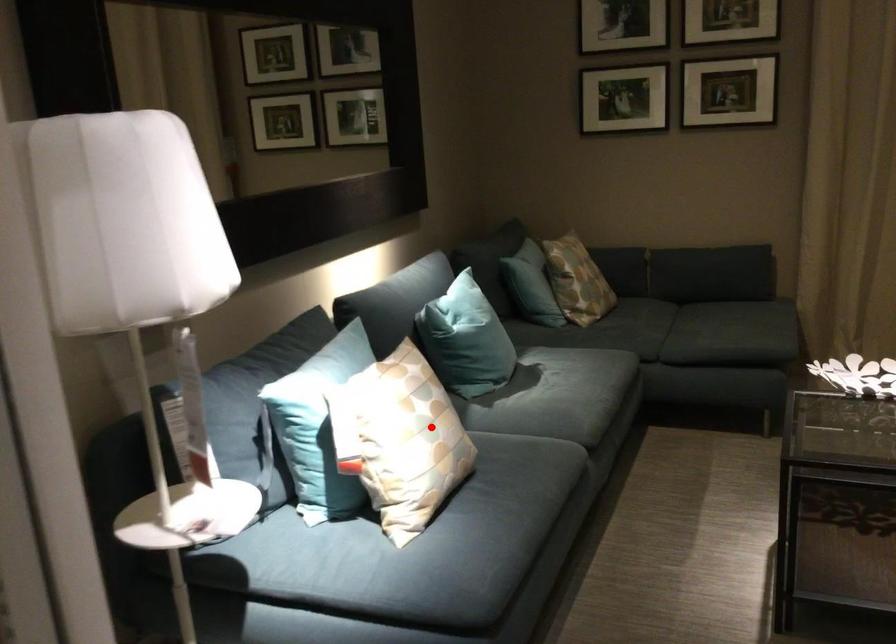
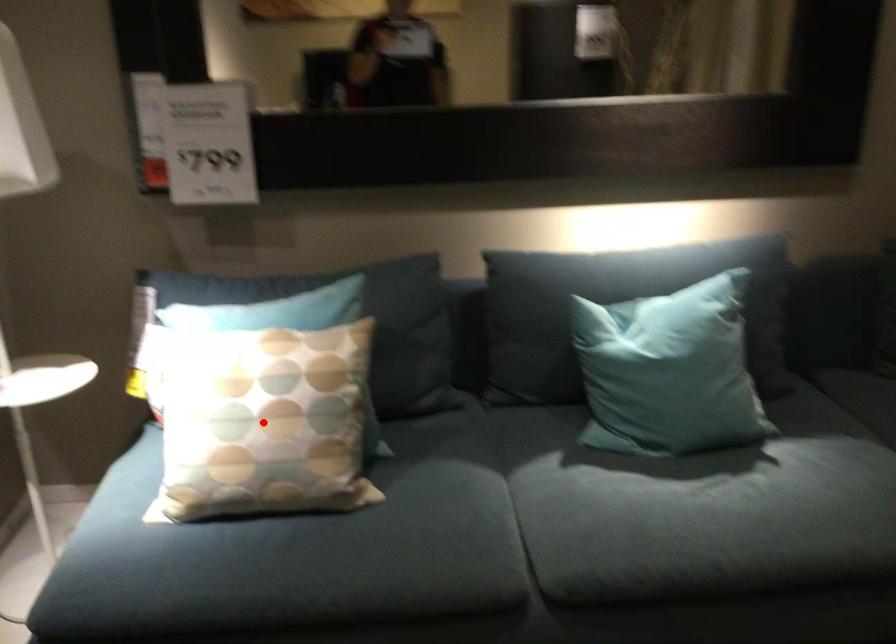
I am providing you with two images of the same scene from different viewpoints. A red point is marked on the first image and another point is marked on the second image. Are the points marked in image1 and image2 representing the same 3D position?

Yes